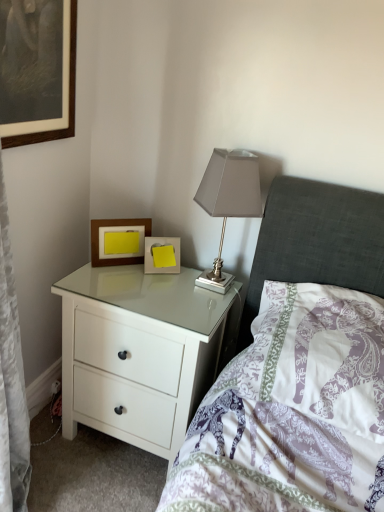
How much space does wooden framed picture at upper left, the 1th picture frame viewed from the left, occupy horizontally?

wooden framed picture at upper left, the 1th picture frame viewed from the left, is 1.81 inches in width.

I want to click on wooden framed picture at upper left, which is the third picture frame from right to left, so click(69, 100).

From a real-world perspective, is white glossy chest of drawers at center physically located above or below purple printed pillow at center?

white glossy chest of drawers at center is situated lower than purple printed pillow at center in the real world.

From the image's perspective, which is above, white glossy chest of drawers at center or purple printed pillow at center?

purple printed pillow at center.

Could you tell me if white glossy chest of drawers at center is turned towards purple printed pillow at center?

No, white glossy chest of drawers at center is not aimed at purple printed pillow at center.

In terms of height, does white glossy chest of drawers at center look taller or shorter compared to purple printed pillow at center?

In the image, white glossy chest of drawers at center appears to be taller than purple printed pillow at center.

Does point (148, 269) appear closer or farther from the camera than point (4, 144)?

Point (148, 269) is positioned farther from the camera compared to point (4, 144).

Which object is more forward, yellow paper at center, which is the third picture frame from left to right, or wooden framed picture at upper left, positioned as the third picture frame in bottom-to-top order?

Positioned in front is wooden framed picture at upper left, positioned as the third picture frame in bottom-to-top order.

From the image's perspective, between yellow paper at center, which is the 1th picture frame in right-to-left order, and wooden framed picture at upper left, the 1th picture frame viewed from the left, who is located below?

yellow paper at center, which is the 1th picture frame in right-to-left order, from the image's perspective.

Based on the photo, from a real-world perspective, which is physically above, yellow paper at center, which is the 1th picture frame in right-to-left order, or wooden framed picture at upper left, which is the third picture frame from right to left?

In real-world perspective, wooden framed picture at upper left, which is the third picture frame from right to left, is above.

Which of these two, wooden framed picture at upper left, which is the third picture frame from right to left, or purple printed pillow at center, is wider?

→ Wider between the two is purple printed pillow at center.

Starting from the purple printed pillow at center, which picture frame is the 1st one behind? Please provide its 2D coordinates.

[(69, 100)]

Which of these two, wooden framed picture at upper left, the 1th picture frame viewed from the left, or purple printed pillow at center, is smaller?

wooden framed picture at upper left, the 1th picture frame viewed from the left.

Does point (349, 410) come farther from viewer compared to point (97, 252)?

No, it is not.

Where is `the 2nd picture frame behind the purple printed pillow at center, counting from the anchor's position`? This screenshot has width=384, height=512. the 2nd picture frame behind the purple printed pillow at center, counting from the anchor's position is located at coordinates (115, 225).

Does purple printed pillow at center appear on the right side of wooden picture frame at upper left, positioned as the 2th picture frame in left-to-right order?

Indeed, purple printed pillow at center is positioned on the right side of wooden picture frame at upper left, positioned as the 2th picture frame in left-to-right order.

Who is bigger, purple printed pillow at center or wooden picture frame at upper left, which is the second picture frame from bottom to top?

With larger size is purple printed pillow at center.

From a real-world perspective, which object rests below the other?

In real-world perspective, yellow paper at center, the 1th picture frame in the bottom-to-top sequence, is lower.

Consider the image. Does yellow paper at center, the 1th picture frame in the bottom-to-top sequence, turn towards wooden picture frame at upper left, which is the second picture frame from bottom to top?

No, yellow paper at center, the 1th picture frame in the bottom-to-top sequence, is not oriented towards wooden picture frame at upper left, which is the second picture frame from bottom to top.

Considering the relative sizes of yellow paper at center, which is the 1th picture frame in right-to-left order, and wooden picture frame at upper left, which appears as the second picture frame when viewed from the right, in the image provided, is yellow paper at center, which is the 1th picture frame in right-to-left order, shorter than wooden picture frame at upper left, which appears as the second picture frame when viewed from the right,?

Correct, yellow paper at center, which is the 1th picture frame in right-to-left order, is not as tall as wooden picture frame at upper left, which appears as the second picture frame when viewed from the right.

Considering the sizes of wooden framed picture at upper left, which is the third picture frame from right to left, and white glossy chest of drawers at center in the image, is wooden framed picture at upper left, which is the third picture frame from right to left, taller or shorter than white glossy chest of drawers at center?

In the image, wooden framed picture at upper left, which is the third picture frame from right to left, appears to be shorter than white glossy chest of drawers at center.

Does wooden framed picture at upper left, the 1th picture frame viewed from the left, come behind white glossy chest of drawers at center?

No, wooden framed picture at upper left, the 1th picture frame viewed from the left, is closer to the viewer.

Considering the sizes of wooden framed picture at upper left, the first picture frame in the top-to-bottom sequence, and white glossy chest of drawers at center in the image, is wooden framed picture at upper left, the first picture frame in the top-to-bottom sequence, bigger or smaller than white glossy chest of drawers at center?

Considering their sizes, wooden framed picture at upper left, the first picture frame in the top-to-bottom sequence, takes up less space than white glossy chest of drawers at center.

Which is more to the left, wooden framed picture at upper left, positioned as the third picture frame in bottom-to-top order, or white glossy chest of drawers at center?

wooden framed picture at upper left, positioned as the third picture frame in bottom-to-top order, is more to the left.

Is point (159, 278) positioned behind point (91, 244)?

No, it is not.

Can you confirm if white glossy chest of drawers at center is smaller than wooden picture frame at upper left, the second picture frame in the top-to-bottom sequence?

Actually, white glossy chest of drawers at center might be larger than wooden picture frame at upper left, the second picture frame in the top-to-bottom sequence.

Is white glossy chest of drawers at center positioned beyond the bounds of wooden picture frame at upper left, which appears as the second picture frame when viewed from the right?

Yes, white glossy chest of drawers at center is outside of wooden picture frame at upper left, which appears as the second picture frame when viewed from the right.

In the image, is white glossy chest of drawers at center positioned in front of or behind wooden picture frame at upper left, which appears as the second picture frame when viewed from the right?

white glossy chest of drawers at center is in front of wooden picture frame at upper left, which appears as the second picture frame when viewed from the right.

The height and width of the screenshot is (512, 384). What are the coordinates of `pillow on the right of white glossy chest of drawers at center` in the screenshot? It's located at (324, 354).

Locate an element on the screen. picture frame that is the 2nd object located in front of the yellow paper at center, which is the third picture frame from left to right is located at coordinates (69, 100).

From the image, which object appears to be farther from yellow paper at center, which is the third picture frame from left to right, white glossy chest of drawers at center or wooden picture frame at upper left, which is the second picture frame from bottom to top?

The object further to yellow paper at center, which is the third picture frame from left to right, is white glossy chest of drawers at center.

Considering their positions, is satin silver table lamp at upper right positioned further to wooden picture frame at upper left, which is the second picture frame from bottom to top, than yellow paper at center, which is the 1th picture frame in right-to-left order?

satin silver table lamp at upper right lies further to wooden picture frame at upper left, which is the second picture frame from bottom to top, than the other object.

From the picture: Looking at the image, which one is located closer to satin silver table lamp at upper right, wooden framed picture at upper left, the first picture frame in the top-to-bottom sequence, or wooden picture frame at upper left, positioned as the 2th picture frame in left-to-right order?

The object closer to satin silver table lamp at upper right is wooden picture frame at upper left, positioned as the 2th picture frame in left-to-right order.

Estimate the real-world distances between objects in this image. Which object is closer to yellow paper at center, which is the third picture frame from left to right, wooden picture frame at upper left, which is the second picture frame from bottom to top, or white glossy chest of drawers at center?

wooden picture frame at upper left, which is the second picture frame from bottom to top.

Estimate the real-world distances between objects in this image. Which object is further from wooden framed picture at upper left, positioned as the third picture frame in bottom-to-top order, satin silver table lamp at upper right or purple printed pillow at center?

The object further to wooden framed picture at upper left, positioned as the third picture frame in bottom-to-top order, is purple printed pillow at center.

From the picture: From the image, which object appears to be nearer to white glossy chest of drawers at center, yellow paper at center, which is the third picture frame from left to right, or wooden picture frame at upper left, which is the second picture frame from bottom to top?

yellow paper at center, which is the third picture frame from left to right, is closer to white glossy chest of drawers at center.

Estimate the real-world distances between objects in this image. Which object is closer to wooden framed picture at upper left, the first picture frame in the top-to-bottom sequence, white glossy chest of drawers at center or yellow paper at center, the 1th picture frame in the bottom-to-top sequence?

Among the two, yellow paper at center, the 1th picture frame in the bottom-to-top sequence, is located nearer to wooden framed picture at upper left, the first picture frame in the top-to-bottom sequence.

Looking at the image, which one is located further to wooden picture frame at upper left, which is the second picture frame from bottom to top, yellow paper at center, the 1th picture frame in the bottom-to-top sequence, or purple printed pillow at center?

Based on the image, purple printed pillow at center appears to be further to wooden picture frame at upper left, which is the second picture frame from bottom to top.

I want to click on picture frame between wooden picture frame at upper left, positioned as the 2th picture frame in left-to-right order, and white glossy chest of drawers at center vertically, so click(x=162, y=255).

The width and height of the screenshot is (384, 512). Identify the location of pillow between wooden framed picture at upper left, which is the third picture frame from right to left, and white glossy chest of drawers at center from top to bottom. (324, 354).

Find the location of a particular element. The width and height of the screenshot is (384, 512). table lamp between white glossy chest of drawers at center and purple printed pillow at center is located at coordinates (228, 201).

Find the location of a particular element. The image size is (384, 512). picture frame between wooden picture frame at upper left, positioned as the 2th picture frame in left-to-right order, and purple printed pillow at center is located at coordinates (162, 255).